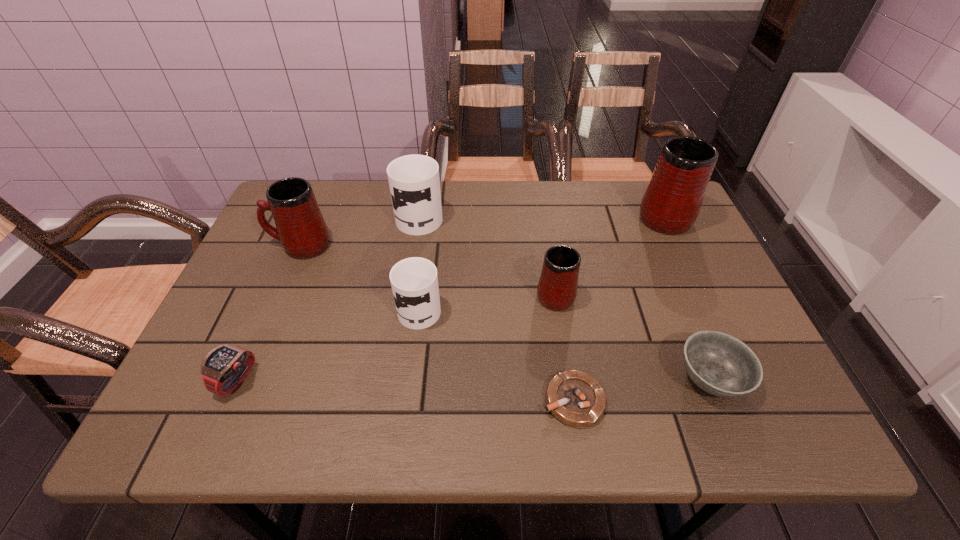
The height and width of the screenshot is (540, 960). Find the location of `object at the far left corner`. object at the far left corner is located at coordinates (300, 227).

Where is `object that is at the near left corner`? This screenshot has height=540, width=960. object that is at the near left corner is located at coordinates point(224,368).

I want to click on object positioned at the far right corner, so click(671, 203).

The width and height of the screenshot is (960, 540). Find the location of `object present at the near right corner`. object present at the near right corner is located at coordinates (720, 364).

In the image, there is a desktop. Where is `vacant space at the far edge`? This screenshot has height=540, width=960. vacant space at the far edge is located at coordinates (479, 218).

Locate an element on the screen. The width and height of the screenshot is (960, 540). free region at the near edge of the desktop is located at coordinates (373, 419).

This screenshot has height=540, width=960. In the image, there is a desktop. Find the location of `free space at the left edge`. free space at the left edge is located at coordinates (188, 389).

Image resolution: width=960 pixels, height=540 pixels. In order to click on vacant space at the right edge of the desktop in this screenshot , I will do `click(665, 292)`.

The image size is (960, 540). I want to click on vacant space at the near right corner of the desktop, so click(x=727, y=410).

You are a GUI agent. You are given a task and a screenshot of the screen. Output one action in this format:
    pyautogui.click(x=<x>, y=<y>)
    Task: Click on the free space between the shortest object and the leftmost red mug
    
    Given the screenshot: What is the action you would take?
    pyautogui.click(x=437, y=322)